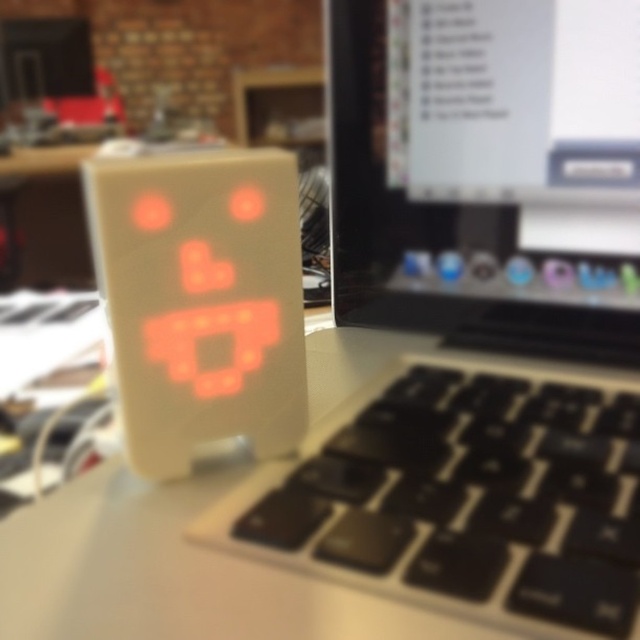
Between matte black laptop at center and black plastic keyboard at lower right, which one has less height?

black plastic keyboard at lower right is shorter.

Can you confirm if matte black laptop at center is bigger than black plastic keyboard at lower right?

Correct, matte black laptop at center is larger in size than black plastic keyboard at lower right.

Where is `matte black laptop at center`? matte black laptop at center is located at coordinates (476, 320).